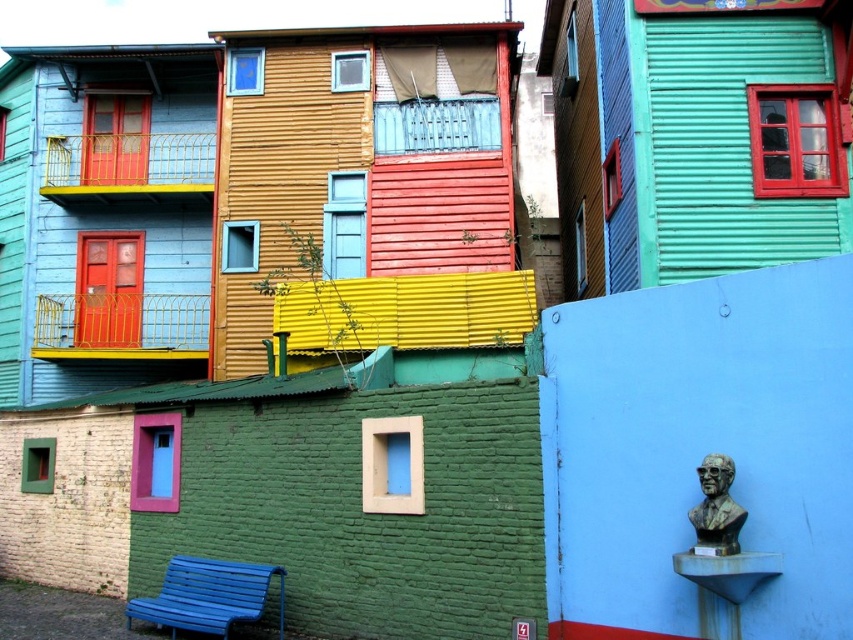
You are standing at the point with coordinates point (207, 595) in the image. What object is located at that position?

The point (207, 595) corresponds to the blue painted wood bench at lower left.

You are standing in the middle of a vibrant street with colorful buildings. There is a point marked at coordinates point (254, 573). Can you determine if this point is within a safe distance for a drone to capture aerial footage without getting too close to the buildings?

The distance of point (254, 573) from viewer is 9.78 meters. Since the point is 9.78 meters away, it is within a safe distance for a drone to capture aerial footage without getting too close to the buildings.

You are a tourist standing in the middle of the street looking at the blue painted wood bench at lower left and the bronze bust at right. Which object is positioned further to the left?

The blue painted wood bench at lower left is positioned further to the left than the bronze bust at right.